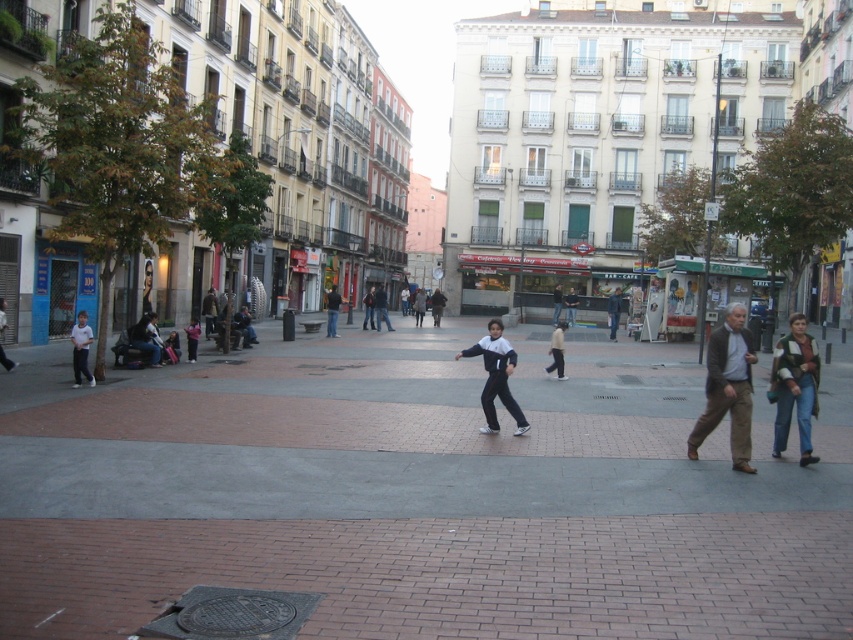
Question: Where is white and black tracksuit at center located in relation to light blue denim pants at center in the image?

Choices:
 (A) right
 (B) left

Answer: (B)

Question: Where is brown leather jacket at right located in relation to dark blue jeans at center in the image?

Choices:
 (A) below
 (B) above

Answer: (A)

Question: Among these points, which one is nearest to the camera?

Choices:
 (A) (486, 388)
 (B) (717, 394)
 (C) (608, 320)

Answer: (B)

Question: Which object is positioned closest to the brown leather jacket at right?

Choices:
 (A) light blue denim pants at center
 (B) dark blue jeans at center

Answer: (A)

Question: Based on their relative distances, which object is nearer to the light blue denim pants at center?

Choices:
 (A) brown leather jacket at right
 (B) dark blue jeans at center

Answer: (A)

Question: Observing the image, what is the correct spatial positioning of light blue denim pants at center in reference to dark blue jeans at center?

Choices:
 (A) above
 (B) below

Answer: (B)